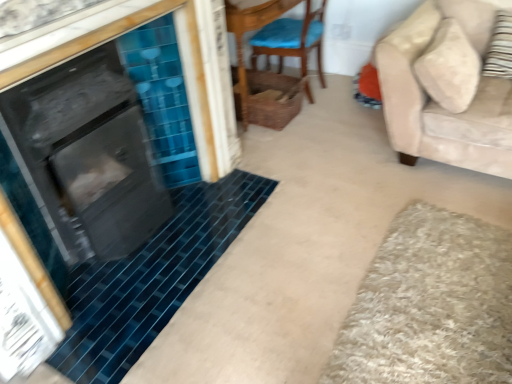
Question: Is there a large distance between woven wicker basket at upper center and striped fabric pillow at right?

Choices:
 (A) no
 (B) yes

Answer: (B)

Question: Does woven wicker basket at upper center come in front of striped fabric pillow at right?

Choices:
 (A) yes
 (B) no

Answer: (B)

Question: Does woven wicker basket at upper center have a greater height compared to striped fabric pillow at right?

Choices:
 (A) yes
 (B) no

Answer: (A)

Question: Does woven wicker basket at upper center contain striped fabric pillow at right?

Choices:
 (A) yes
 (B) no

Answer: (B)

Question: From the image's perspective, would you say woven wicker basket at upper center is shown under striped fabric pillow at right?

Choices:
 (A) yes
 (B) no

Answer: (B)

Question: Does point (461, 0) appear closer or farther from the camera than point (496, 34)?

Choices:
 (A) closer
 (B) farther

Answer: (B)

Question: In terms of height, does beige fabric couch at right look taller or shorter compared to striped fabric pillow at right?

Choices:
 (A) short
 (B) tall

Answer: (B)

Question: From the image's perspective, is beige fabric couch at right located above or below striped fabric pillow at right?

Choices:
 (A) below
 (B) above

Answer: (A)

Question: Is beige fabric couch at right to the left or to the right of striped fabric pillow at right in the image?

Choices:
 (A) right
 (B) left

Answer: (B)

Question: Is striped fabric pillow at right spatially inside wooden chair with blue cushion at center, or outside of it?

Choices:
 (A) inside
 (B) outside

Answer: (B)

Question: From their relative heights in the image, would you say striped fabric pillow at right is taller or shorter than wooden chair with blue cushion at center?

Choices:
 (A) tall
 (B) short

Answer: (B)

Question: Considering the relative positions of striped fabric pillow at right and wooden chair with blue cushion at center in the image provided, is striped fabric pillow at right to the left or to the right of wooden chair with blue cushion at center?

Choices:
 (A) left
 (B) right

Answer: (B)

Question: Considering the positions of striped fabric pillow at right and wooden chair with blue cushion at center in the image, is striped fabric pillow at right wider or thinner than wooden chair with blue cushion at center?

Choices:
 (A) thin
 (B) wide

Answer: (A)

Question: From the image's perspective, is beige shaggy bath mat at lower right above or below woven wicker basket at upper center?

Choices:
 (A) below
 (B) above

Answer: (A)

Question: Which is correct: beige shaggy bath mat at lower right is inside woven wicker basket at upper center, or outside of it?

Choices:
 (A) inside
 (B) outside

Answer: (B)